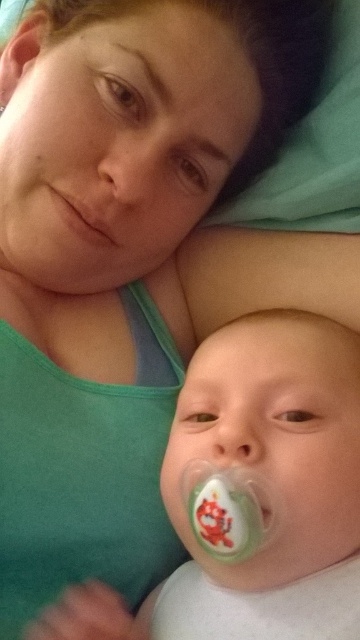
From the picture: You are a photographer trying to focus on the white plastic pacifier at lower center. The camera has a grid overlay with coordinates from 0 to 1 on both axes. What are the exact coordinates where you should aim the camera to capture the pacifier perfectly?

The white plastic pacifier at lower center is located at coordinates 0.773 on the x axis and 0.700 on the y axis, so aim the camera at those exact coordinates to capture it perfectly.

Consider the image. You are a caregiver in a nursery and need to choose between the white plastic pacifier at lower center and the green rubber teething ring at lower center for a baby. Considering their sizes, which one is more appropriate for the baby to hold comfortably?

The green rubber teething ring at lower center is more appropriate for the baby to hold comfortably because it is smaller than the white plastic pacifier at lower center, making it easier for the baby to grip.

You are a photographer trying to capture a close shot of the baby in the image. You need to ensure that both the white plastic pacifier at lower center and the matte pink lips at center are in focus. Based on their positions, which object is closer to the camera?

The white plastic pacifier at lower center is located below matte pink lips at center, so the matte pink lips at center are closer to the camera since it is positioned above the pacifier.